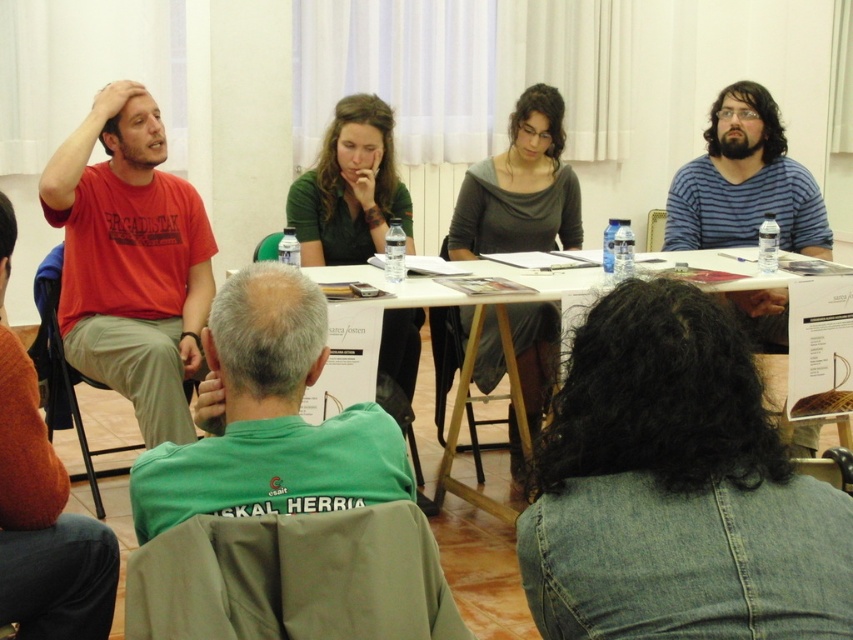
Question: Which object is closer to the camera taking this photo?

Choices:
 (A) matte red shirt at left
 (B) white paper at center
 (C) striped cotton shirt at right

Answer: (B)

Question: Does denim jacket at lower right lie in front of matte red shirt at left?

Choices:
 (A) yes
 (B) no

Answer: (A)

Question: Which point is closer to the camera taking this photo?

Choices:
 (A) (138, 244)
 (B) (541, 282)

Answer: (B)

Question: Which point appears closest to the camera in this image?

Choices:
 (A) (698, 163)
 (B) (196, 282)
 (C) (657, 353)
 (D) (143, 470)

Answer: (C)

Question: In this image, where is matte red shirt at left located relative to white paper at center?

Choices:
 (A) below
 (B) above

Answer: (B)

Question: Can you confirm if green fabric shirt at lower left is wider than striped cotton shirt at right?

Choices:
 (A) no
 (B) yes

Answer: (A)